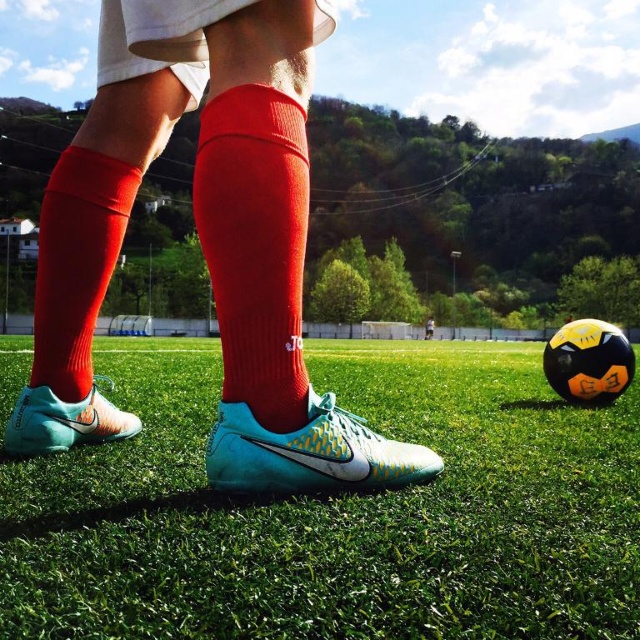
Which is in front, point (349, 560) or point (364, 470)?

Positioned in front is point (349, 560).

The height and width of the screenshot is (640, 640). I want to click on green artificial turf at center, so click(333, 509).

How much distance is there between knitted red sock at center and teal matte soccer cleat at lower left?

knitted red sock at center and teal matte soccer cleat at lower left are 44.94 centimeters apart from each other.

Which is behind, point (296, 380) or point (99, 401)?

Positioned behind is point (99, 401).

Which is behind, point (296, 138) or point (83, 422)?

Point (83, 422)

The image size is (640, 640). Find the location of `knitted red sock at center`. knitted red sock at center is located at coordinates (256, 244).

Which is more to the right, knitted red sock at center or teal matte nike cleat at center?

From the viewer's perspective, teal matte nike cleat at center appears more on the right side.

Is the position of knitted red sock at center less distant than that of teal matte nike cleat at center?

Yes, it is.

Between point (273, 355) and point (216, 420), which one is positioned behind?

The point (216, 420) is behind.

What are the coordinates of `knitted red sock at center` in the screenshot? It's located at (256, 244).